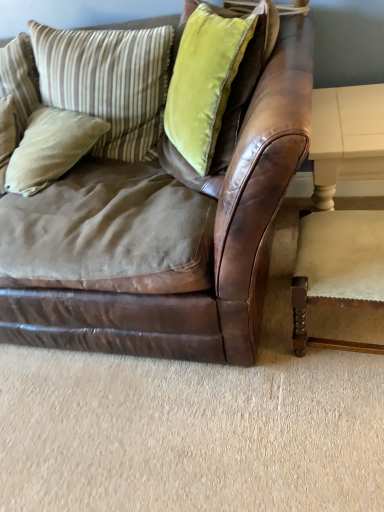
This screenshot has height=512, width=384. I want to click on free space above white painted wood table at right (from a real-world perspective), so click(x=341, y=111).